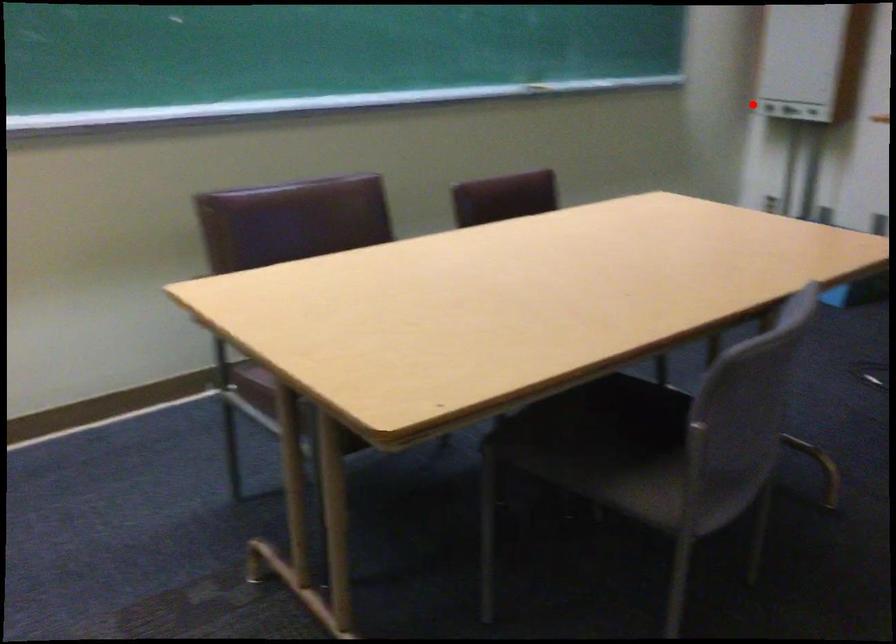
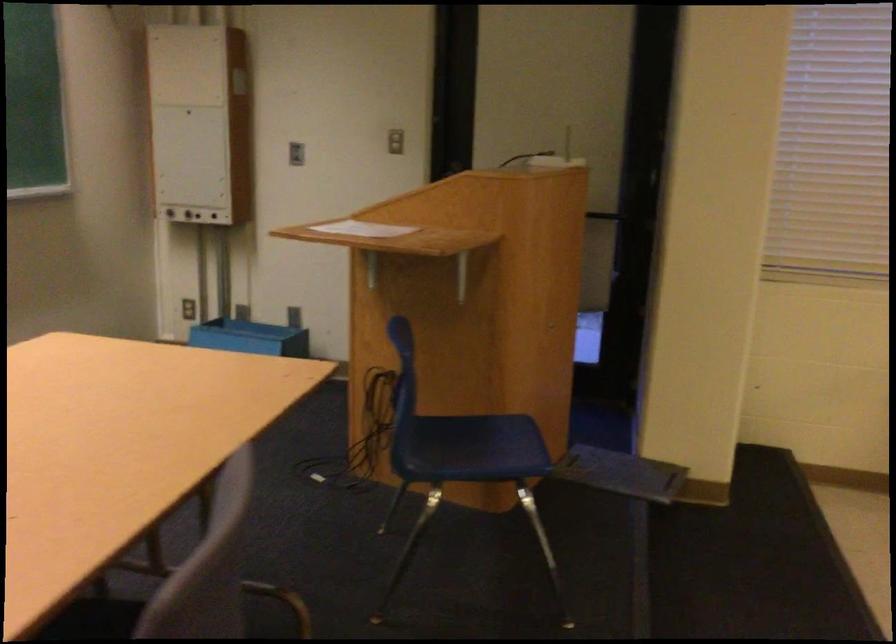
Question: I am providing you with two images of the same scene from different viewpoints. Given a red point in image1, look at the same physical point in image2. Is it:

Choices:
 (A) Closer to the viewpoint
 (B) Farther from the viewpoint

Answer: (A)